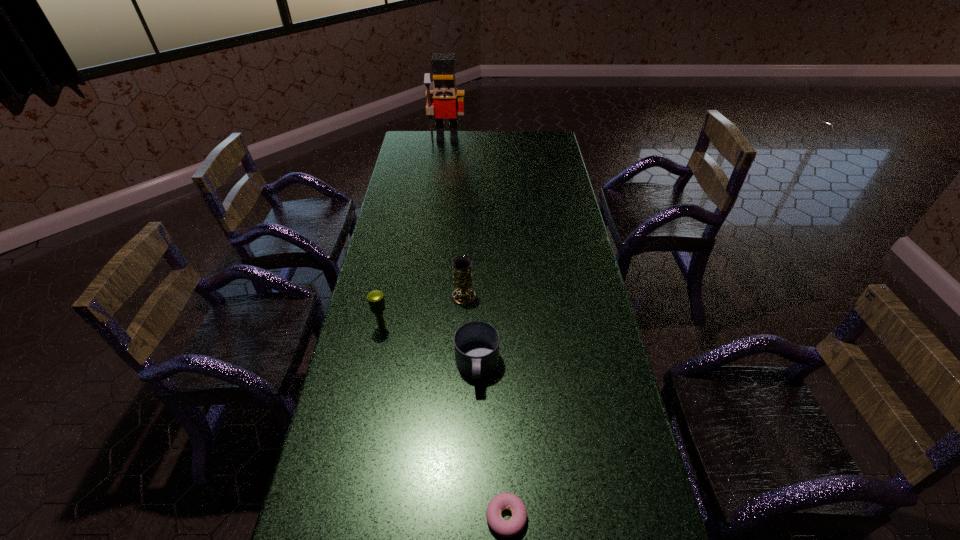
Identify the location of blank space located 0.390m on the right of the chalice. (589, 297).

I want to click on free space located on the front of the leftmost object, so click(x=363, y=427).

Locate an element on the screen. The image size is (960, 540). blank space located 0.320m on the side of the fifth farthest object with the handle is located at coordinates (476, 515).

Where is `free space located on the front-facing side of the second farthest object`? The height and width of the screenshot is (540, 960). free space located on the front-facing side of the second farthest object is located at coordinates (482, 265).

Where is `vacant area located on the right of the doughnut`? vacant area located on the right of the doughnut is located at coordinates (627, 517).

Find the location of a particular element. object situated at the far edge is located at coordinates (444, 100).

Find the location of a particular element. This screenshot has height=540, width=960. nutcracker that is at the left edge is located at coordinates (444, 100).

Locate an element on the screen. Image resolution: width=960 pixels, height=540 pixels. microphone situated at the left edge is located at coordinates (377, 305).

Where is `object that is at the far left corner`? This screenshot has width=960, height=540. object that is at the far left corner is located at coordinates (444, 100).

The width and height of the screenshot is (960, 540). In the image, there is a desktop. In order to click on vacant area at the far edge in this screenshot , I will do `click(502, 138)`.